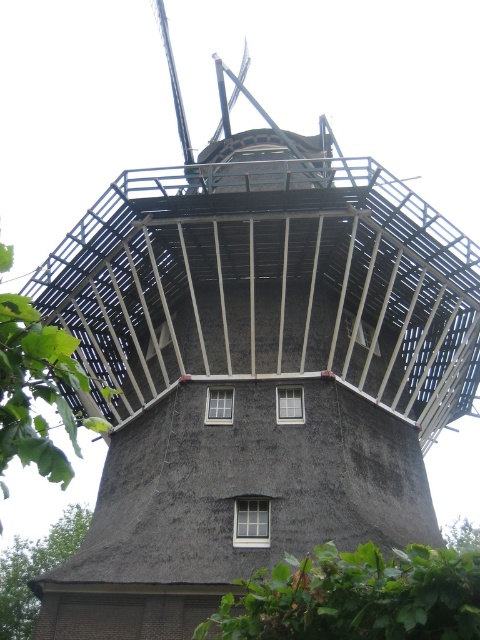
You are standing 20 meters away from the green leafy tree at upper left. Can you see the windmill behind the tree?

The green leafy tree at upper left is 27.06 meters from viewer, so you are 7.06 meters behind the tree. Therefore, you can see the windmill behind the tree.

You are planning to take a photo of the green leafy tree at upper left and the green thatch roof at lower left in the scene. Which object should you focus on first if you want to capture both in a single frame without moving the camera?

You should focus on the green leafy tree at upper left first because it is larger in size than the green thatch roof at lower left, so it will require more space in the frame.

You are standing in front of the windmill and notice a green leafy tree at upper left and a green thatch roof at lower left. Which object is wider?

The green leafy tree at upper left is wider than the green thatch roof at lower left.